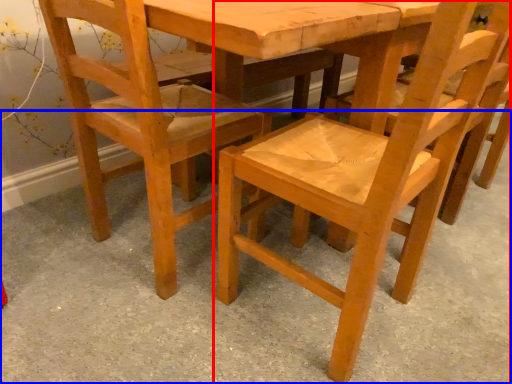
Question: Which point is closer to the camera, chair (highlighted by a red box) or concrete (highlighted by a blue box)?

Choices:
 (A) chair
 (B) concrete

Answer: (B)